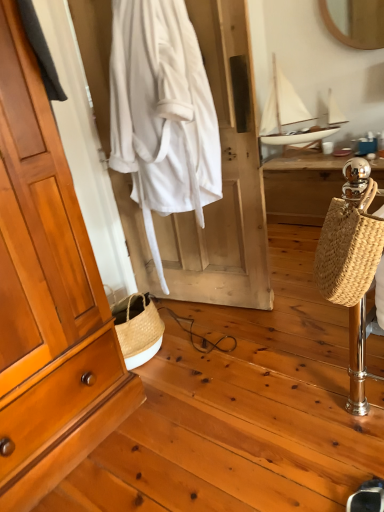
Question: From a real-world perspective, relative to white cotton robe at center, is woven straw bag at right vertically above or below?

Choices:
 (A) above
 (B) below

Answer: (B)

Question: From the image's perspective, is woven straw bag at right located above or below white cotton robe at center?

Choices:
 (A) below
 (B) above

Answer: (A)

Question: Estimate the real-world distances between objects in this image. Which object is closer to the woven straw bag at right?

Choices:
 (A) white cotton robe at center
 (B) black suede shoe at lower right
 (C) woven wood desk at right
 (D) white matte coffee cup at center
 (E) white matte sailboat at upper right

Answer: (B)

Question: Estimate the real-world distances between objects in this image. Which object is closer to the black suede shoe at lower right?

Choices:
 (A) white matte coffee cup at center
 (B) matte wood cabinet at left
 (C) woven wood desk at right
 (D) woven straw bag at right
 (E) white matte sailboat at upper right

Answer: (D)